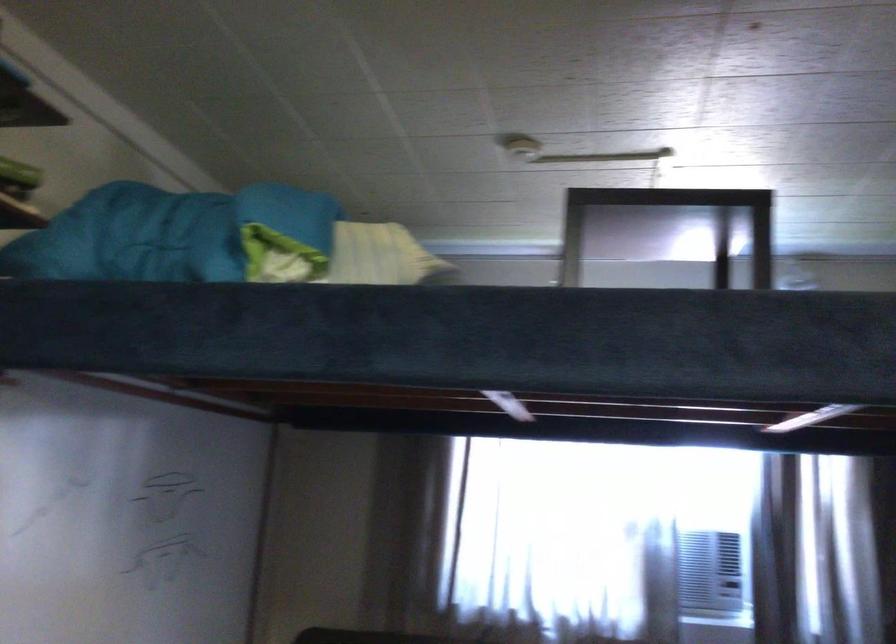
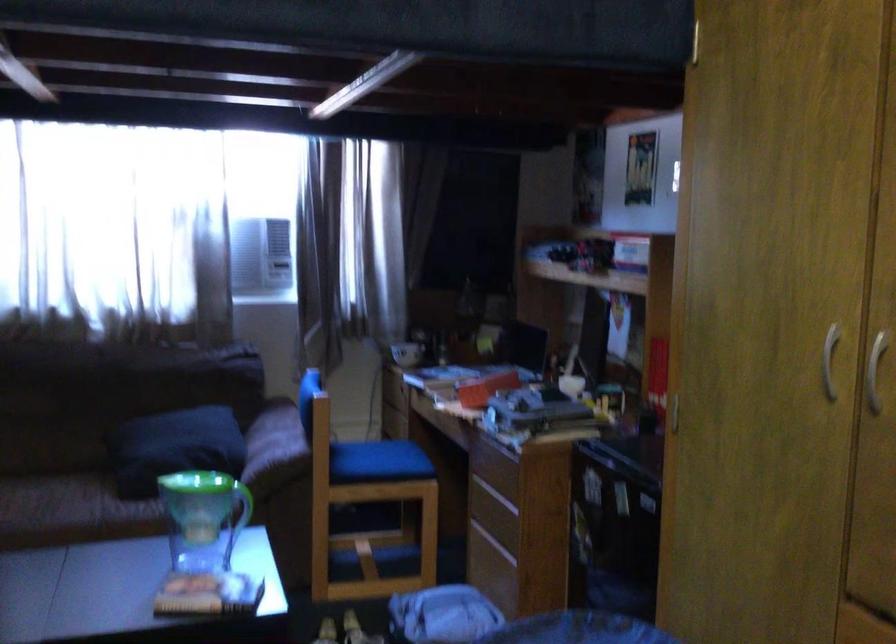
The first image is from the beginning of the video and the second image is from the end. How did the camera likely rotate when shooting the video?

The camera's rotation is toward right-down.